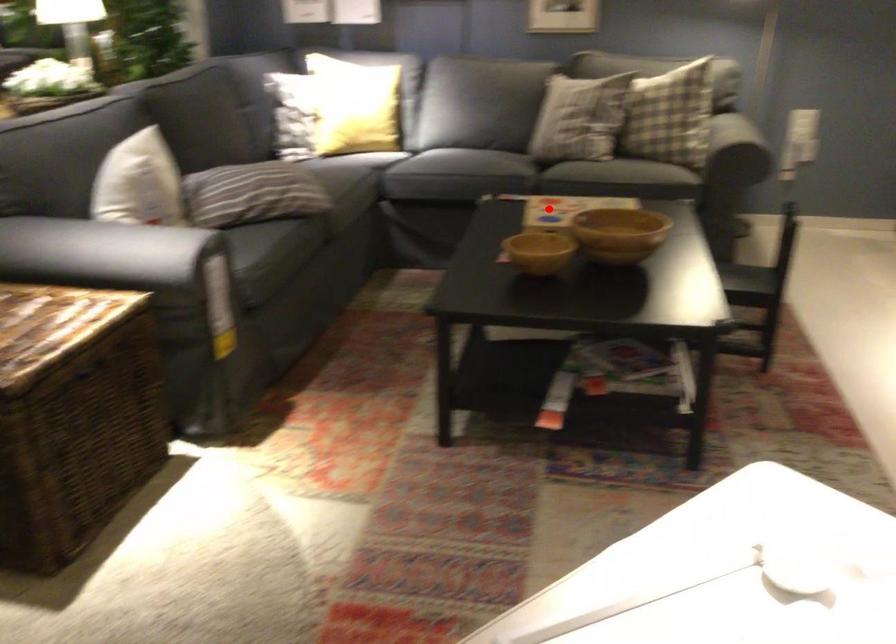
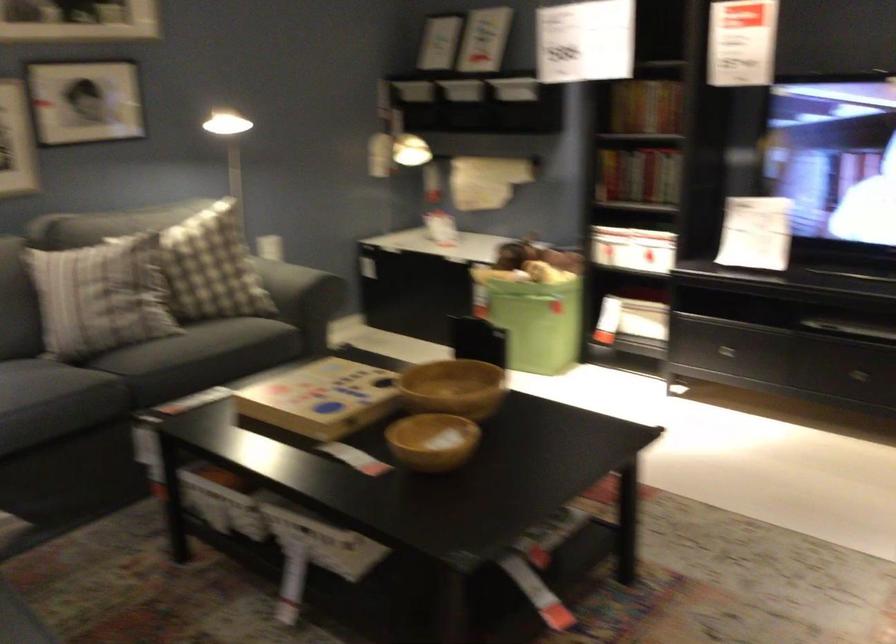
Question: A red point is marked in image1. In image2, is the corresponding 3D point closer to the camera or farther? Reply with the corresponding letter.

Choices:
 (A) The corresponding 3D point is closer.
 (B) The corresponding 3D point is farther.

Answer: (A)